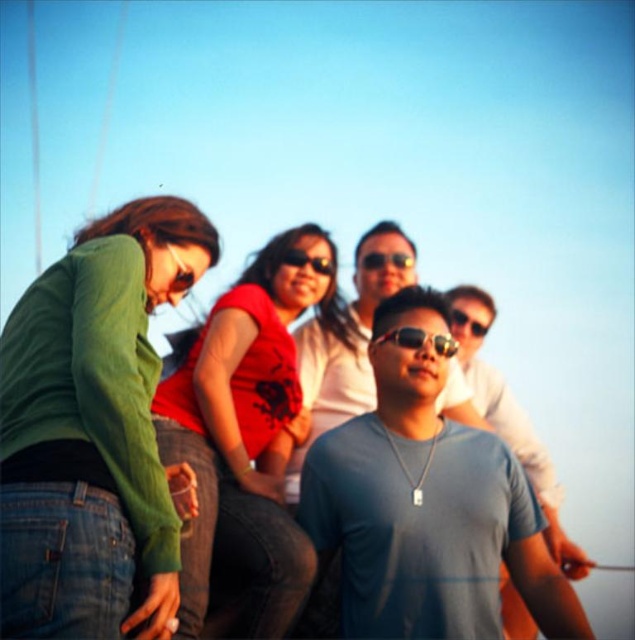
Who is positioned more to the right, matte blue t-shirt at center or black plastic sunglasses at center?

From the viewer's perspective, black plastic sunglasses at center appears more on the right side.

Does matte blue t-shirt at center come behind black plastic sunglasses at center?

No.

Is point (417, 563) behind point (481, 333)?

No, (417, 563) is closer to viewer.

Identify the location of matte blue t-shirt at center. The width and height of the screenshot is (635, 640). (427, 516).

Consider the image. Is matte blue t-shirt at center taller than matte red shirt at center?

No.

Can you confirm if matte blue t-shirt at center is shorter than matte red shirt at center?

Correct, matte blue t-shirt at center is not as tall as matte red shirt at center.

At what (x,y) coordinates should I click in order to perform the action: click on matte blue t-shirt at center. Please return your answer as a coordinate pair (x, y). The width and height of the screenshot is (635, 640). Looking at the image, I should click on (427, 516).

Identify the location of matte blue t-shirt at center. Image resolution: width=635 pixels, height=640 pixels. (427, 516).

Locate an element on the screen. This screenshot has width=635, height=640. matte red shirt at center is located at coordinates (244, 440).

Does point (276, 616) come farther from viewer compared to point (330, 269)?

No, (276, 616) is in front of (330, 269).

The height and width of the screenshot is (640, 635). What do you see at coordinates (244, 440) in the screenshot?
I see `matte red shirt at center` at bounding box center [244, 440].

The height and width of the screenshot is (640, 635). I want to click on matte red shirt at center, so click(x=244, y=440).